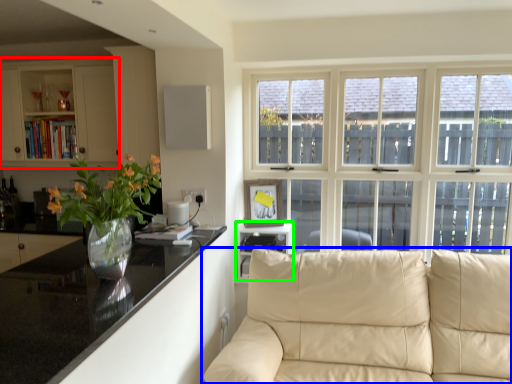
Question: Which object is the closest to the cabinetry (highlighted by a red box)? Choose among these: studio couch (highlighted by a blue box) or shelf (highlighted by a green box).

Choices:
 (A) studio couch
 (B) shelf

Answer: (B)